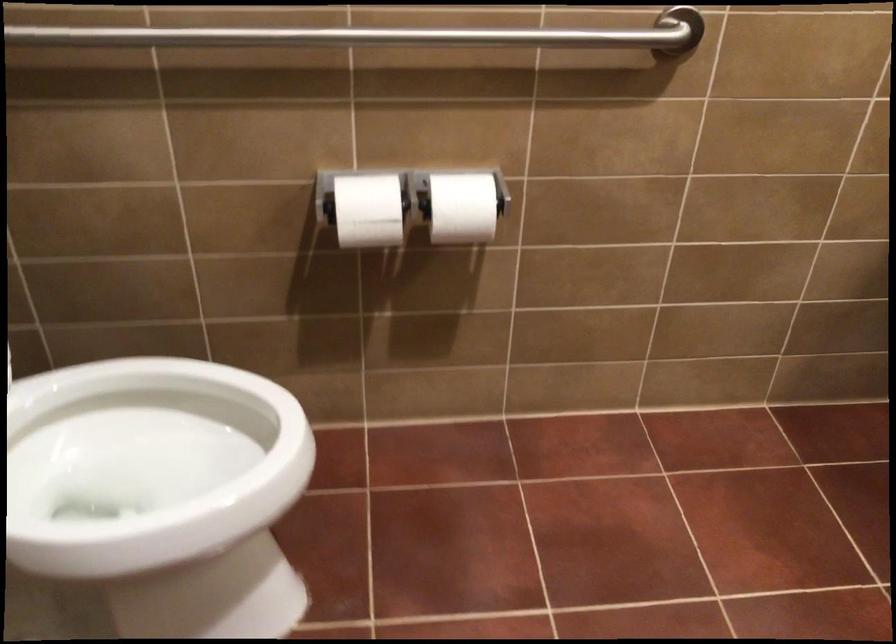
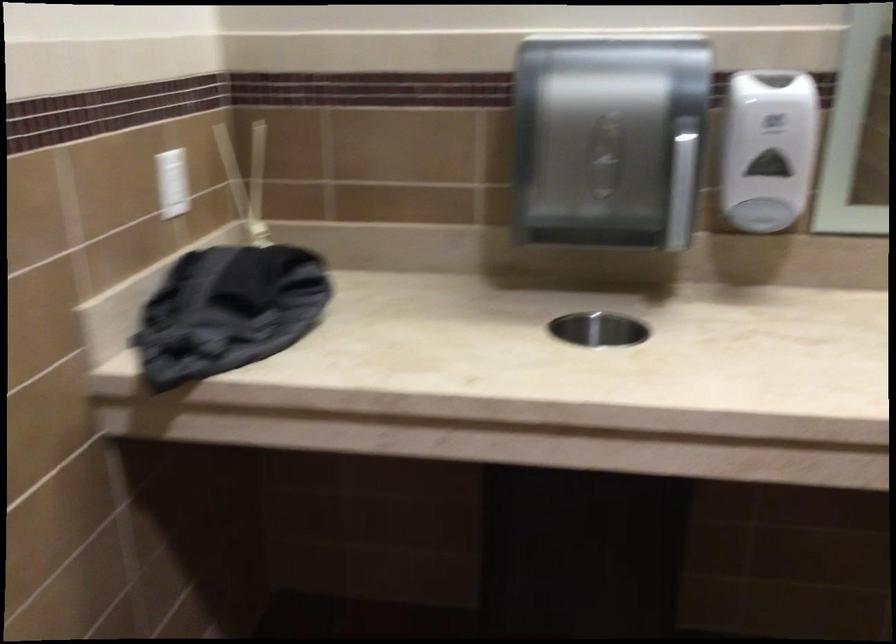
Question: The first image is from the beginning of the video and the second image is from the end. How did the camera likely rotate when shooting the video?

Choices:
 (A) Left
 (B) Right
 (C) Up
 (D) Down

Answer: (B)